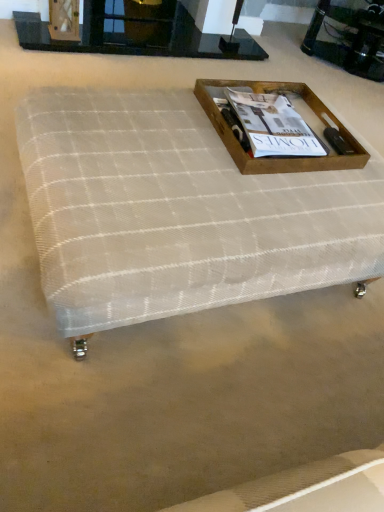
Where is `matte brown wooden tray at upper center`? Image resolution: width=384 pixels, height=512 pixels. matte brown wooden tray at upper center is located at coordinates (273, 125).

Locate an element on the screen. This screenshot has height=512, width=384. black glass fireplace at upper center is located at coordinates (138, 33).

Locate an element on the screen. This screenshot has height=512, width=384. matte brown wooden tray at upper center is located at coordinates (273, 125).

From the image's perspective, is black glass fireplace at upper center located beneath shiny black glass tray at upper right?

Indeed, from the image's perspective, black glass fireplace at upper center is shown beneath shiny black glass tray at upper right.

How different are the orientations of black glass fireplace at upper center and shiny black glass tray at upper right in degrees?

The angle between the facing direction of black glass fireplace at upper center and the facing direction of shiny black glass tray at upper right is 34.1 degrees.

From a real-world perspective, is black glass fireplace at upper center above or below shiny black glass tray at upper right?

From a real-world perspective, black glass fireplace at upper center is physically below shiny black glass tray at upper right.

Is black glass fireplace at upper center outside of shiny black glass tray at upper right?

black glass fireplace at upper center lies outside shiny black glass tray at upper right's area.

Considering the positions of objects wooden tray at center and shiny black glass tray at upper right in the image provided, who is more to the left, wooden tray at center or shiny black glass tray at upper right?

wooden tray at center.

In the scene shown: Is wooden tray at center directly adjacent to shiny black glass tray at upper right?

No, wooden tray at center is not making contact with shiny black glass tray at upper right.

Does wooden tray at center have a greater width compared to shiny black glass tray at upper right?

Yes.

Which of these two, wooden tray at center or shiny black glass tray at upper right, stands taller?

With more height is shiny black glass tray at upper right.

Identify the location of mattress lying below the wooden tray at center (from the image's perspective). The width and height of the screenshot is (384, 512). (178, 212).

Considering the positions of objects white mesh ottoman at center and wooden tray at center in the image provided, who is behind, white mesh ottoman at center or wooden tray at center?

wooden tray at center.

Looking at their sizes, would you say white mesh ottoman at center is wider or thinner than wooden tray at center?

Considering their sizes, white mesh ottoman at center looks broader than wooden tray at center.

Is white mesh ottoman at center next to wooden tray at center and touching it?

No, white mesh ottoman at center is not with wooden tray at center.

Based on the photo, is shiny black glass tray at upper right positioned far away from matte brown wooden tray at upper center?

Yes, shiny black glass tray at upper right and matte brown wooden tray at upper center are located far from each other.

Is shiny black glass tray at upper right not inside matte brown wooden tray at upper center?

→ Yes, shiny black glass tray at upper right is located beyond the bounds of matte brown wooden tray at upper center.

From the image's perspective, which is below, shiny black glass tray at upper right or matte brown wooden tray at upper center?

matte brown wooden tray at upper center is shown below in the image.

Who is shorter, shiny black glass tray at upper right or matte brown wooden tray at upper center?

Standing shorter between the two is matte brown wooden tray at upper center.

Is wooden tray at center oriented towards matte brown wooden tray at upper center?

Yes, wooden tray at center is facing matte brown wooden tray at upper center.

From the picture: Is wooden tray at center behind matte brown wooden tray at upper center?

No, wooden tray at center is closer to the camera.

Between wooden tray at center and matte brown wooden tray at upper center, which one has larger size?

Bigger between the two is wooden tray at center.

Could you measure the distance between matte brown wooden tray at upper center and shiny black glass tray at upper right?

The distance of matte brown wooden tray at upper center from shiny black glass tray at upper right is 6.24 feet.

Would you say matte brown wooden tray at upper center is inside or outside shiny black glass tray at upper right?

matte brown wooden tray at upper center is spatially situated outside shiny black glass tray at upper right.

Does matte brown wooden tray at upper center touch shiny black glass tray at upper right?

No, matte brown wooden tray at upper center is not next to shiny black glass tray at upper right.

Can you confirm if matte brown wooden tray at upper center is shorter than shiny black glass tray at upper right?

Yes.

From the image's perspective, is black glass fireplace at upper center located above white mesh ottoman at center?

Correct, black glass fireplace at upper center appears higher than white mesh ottoman at center in the image.

Considering the points (175, 23) and (150, 181), which point is in front, point (175, 23) or point (150, 181)?

Positioned in front is point (150, 181).

From a real-world perspective, between black glass fireplace at upper center and white mesh ottoman at center, who is vertically higher?

white mesh ottoman at center.

Is black glass fireplace at upper center bigger or smaller than white mesh ottoman at center?

Considering their sizes, black glass fireplace at upper center takes up less space than white mesh ottoman at center.

Find the location of a particular element. Image resolution: width=384 pixels, height=512 pixels. furniture on the left of shiny black glass tray at upper right is located at coordinates (138, 33).

The image size is (384, 512). Identify the location of box that appears in front of the shiny black glass tray at upper right. (276, 158).

From the image, which object appears to be farther from white mesh ottoman at center, wooden tray at center or black glass fireplace at upper center?

black glass fireplace at upper center is further to white mesh ottoman at center.

Looking at the image, which one is located closer to matte brown wooden tray at upper center, white mesh ottoman at center or black glass fireplace at upper center?

Based on the image, white mesh ottoman at center appears to be nearer to matte brown wooden tray at upper center.

Considering their positions, is matte brown wooden tray at upper center positioned further to white mesh ottoman at center than wooden tray at center?

matte brown wooden tray at upper center lies further to white mesh ottoman at center than the other object.

Looking at the image, which one is located closer to matte brown wooden tray at upper center, black glass fireplace at upper center or white mesh ottoman at center?

The object closer to matte brown wooden tray at upper center is white mesh ottoman at center.

From the image, which object appears to be nearer to matte brown wooden tray at upper center, wooden tray at center or black glass fireplace at upper center?

The object closer to matte brown wooden tray at upper center is wooden tray at center.

From the image, which object appears to be farther from black glass fireplace at upper center, shiny black glass tray at upper right or wooden tray at center?

The object further to black glass fireplace at upper center is wooden tray at center.

When comparing their distances from black glass fireplace at upper center, does wooden tray at center or shiny black glass tray at upper right seem closer?

shiny black glass tray at upper right.

Which object lies nearer to the anchor point black glass fireplace at upper center, wooden tray at center or matte brown wooden tray at upper center?

wooden tray at center is closer to black glass fireplace at upper center.

Find the location of a particular element. This screenshot has width=384, height=512. furniture between wooden tray at center and shiny black glass tray at upper right from front to back is located at coordinates [x=138, y=33].

The width and height of the screenshot is (384, 512). In order to click on furniture positioned between matte brown wooden tray at upper center and shiny black glass tray at upper right from near to far in this screenshot , I will do `click(138, 33)`.

At what (x,y) coordinates should I click in order to perform the action: click on box positioned between white mesh ottoman at center and black glass fireplace at upper center from near to far. Please return your answer as a coordinate pair (x, y). This screenshot has width=384, height=512. Looking at the image, I should click on (276, 158).

The width and height of the screenshot is (384, 512). Find the location of `box positioned between white mesh ottoman at center and shiny black glass tray at upper right from near to far`. box positioned between white mesh ottoman at center and shiny black glass tray at upper right from near to far is located at coordinates (276, 158).